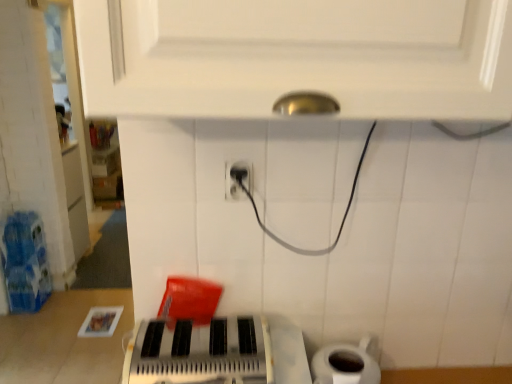
Describe the element at coordinates (201, 352) in the screenshot. This screenshot has width=512, height=384. I see `metallic silver keyboard at center` at that location.

The image size is (512, 384). Identify the location of metallic silver keyboard at center. (201, 352).

Are white matte toilet paper at lower right and metallic silver keyboard at center beside each other?

No, white matte toilet paper at lower right is not touching metallic silver keyboard at center.

Measure the distance between white matte toilet paper at lower right and metallic silver keyboard at center.

white matte toilet paper at lower right is 9.68 inches from metallic silver keyboard at center.

Is white matte toilet paper at lower right located outside metallic silver keyboard at center?

Yes, white matte toilet paper at lower right is outside of metallic silver keyboard at center.

From a real-world perspective, is white matte toilet paper at lower right positioned under metallic silver keyboard at center based on gravity?

Yes, from a real-world perspective, white matte toilet paper at lower right is below metallic silver keyboard at center.

Is black plastic power plug at center far from white matte toilet paper at lower right?

That's not correct — black plastic power plug at center is a little close to white matte toilet paper at lower right.

Do you think black plastic power plug at center is within white matte toilet paper at lower right, or outside of it?

The correct answer is: outside.

From a real-world perspective, is black plastic power plug at center positioned under white matte toilet paper at lower right based on gravity?

No, from a real-world perspective, black plastic power plug at center is not beneath white matte toilet paper at lower right.

Is black plastic power plug at center inside white matte toilet paper at lower right?

No, white matte toilet paper at lower right does not contain black plastic power plug at center.

Between white matte toilet paper at lower right and black plastic power plug at center, which one is positioned in front?

black plastic power plug at center is more forward.

Is white matte toilet paper at lower right far away from black plastic power plug at center?

Actually, white matte toilet paper at lower right and black plastic power plug at center are a little close together.

Is black plastic power plug at center not close to metallic silver keyboard at center?

They are positioned close to each other.

Locate an element on the screen. musical keyboard below the black plastic power plug at center (from a real-world perspective) is located at coordinates tap(201, 352).

In the scene shown: Which of these two, black plastic power plug at center or metallic silver keyboard at center, stands shorter?

Standing shorter between the two is black plastic power plug at center.

Would you say metallic silver keyboard at center is a long distance from black plastic power plug at center?

No.

Is point (139, 358) closer or farther from the camera than point (238, 187)?

Point (139, 358) appears to be closer to the viewer than point (238, 187).

Locate an element on the screen. The width and height of the screenshot is (512, 384). power plugs and sockets on the right of metallic silver keyboard at center is located at coordinates (237, 180).

Is metallic silver keyboard at center to the right of black plastic power plug at center from the viewer's perspective?

Incorrect, metallic silver keyboard at center is not on the right side of black plastic power plug at center.

Does metallic silver keyboard at center contain white matte toilet paper at lower right?

No, white matte toilet paper at lower right is not surrounded by metallic silver keyboard at center.

From a real-world perspective, is metallic silver keyboard at center located beneath white matte toilet paper at lower right?

No.

From the image's perspective, between metallic silver keyboard at center and white matte toilet paper at lower right, which one is located above?

From the image's view, metallic silver keyboard at center is above.

Considering the sizes of objects metallic silver keyboard at center and white matte toilet paper at lower right in the image provided, who is thinner, metallic silver keyboard at center or white matte toilet paper at lower right?

white matte toilet paper at lower right is thinner.

I want to click on musical keyboard on the left of white matte toilet paper at lower right, so click(x=201, y=352).

The width and height of the screenshot is (512, 384). What are the coordinates of `toilet paper below the black plastic power plug at center (from a real-world perspective)` in the screenshot? It's located at (347, 363).

When comparing their distances from black plastic power plug at center, does white matte toilet paper at lower right or metallic silver keyboard at center seem further?

white matte toilet paper at lower right lies further to black plastic power plug at center than the other object.

Considering their positions, is black plastic power plug at center positioned further to white matte toilet paper at lower right than metallic silver keyboard at center?

black plastic power plug at center is further to white matte toilet paper at lower right.

From the image, which object appears to be farther from metallic silver keyboard at center, black plastic power plug at center or white matte toilet paper at lower right?

Based on the image, black plastic power plug at center appears to be further to metallic silver keyboard at center.

From the image, which object appears to be nearer to white matte toilet paper at lower right, metallic silver keyboard at center or black plastic power plug at center?

Based on the image, metallic silver keyboard at center appears to be nearer to white matte toilet paper at lower right.

Looking at the image, which one is located further to metallic silver keyboard at center, white matte toilet paper at lower right or black plastic power plug at center?

black plastic power plug at center lies further to metallic silver keyboard at center than the other object.

In the scene shown: Considering their positions, is metallic silver keyboard at center positioned further to black plastic power plug at center than white matte toilet paper at lower right?

white matte toilet paper at lower right is positioned further to the anchor black plastic power plug at center.

Locate an element on the screen. musical keyboard between black plastic power plug at center and white matte toilet paper at lower right in the vertical direction is located at coordinates 201,352.